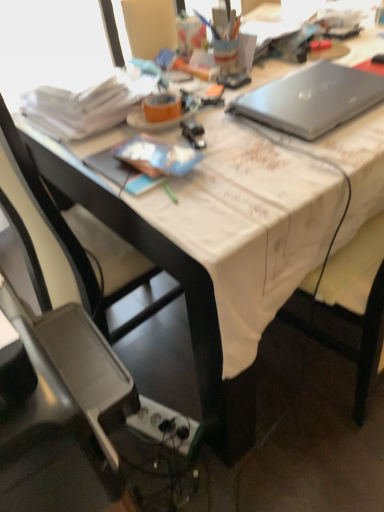
In order to click on vacant area that lies to the right of metallic silver stapler at center in this screenshot , I will do `click(255, 139)`.